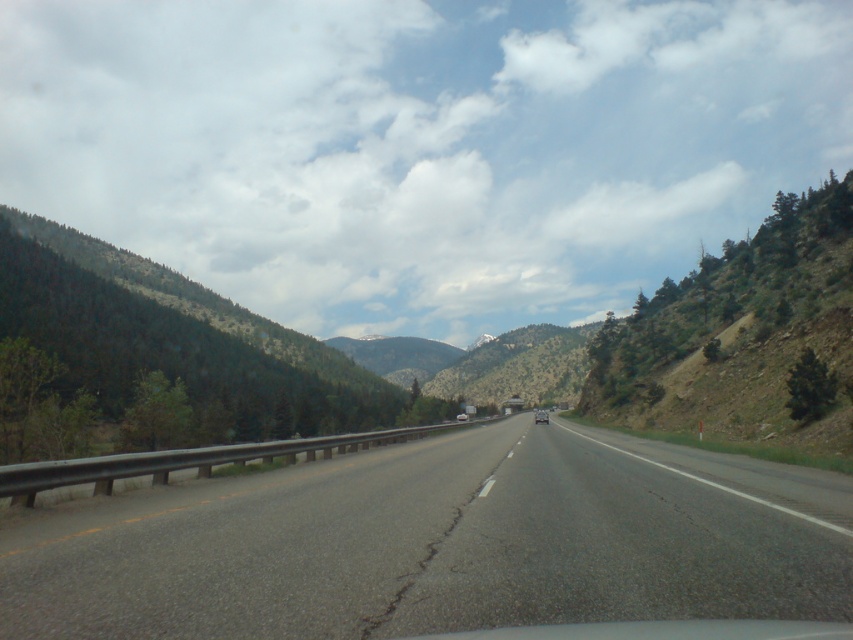
Question: Does metallic silver car at center appear under white glossy car at center?

Choices:
 (A) yes
 (B) no

Answer: (A)

Question: Which point is farther to the camera?

Choices:
 (A) (112, 634)
 (B) (535, 419)

Answer: (B)

Question: From the image, what is the correct spatial relationship of asphalt road at center in relation to white glossy car at center?

Choices:
 (A) below
 (B) above

Answer: (B)

Question: Which of the following is the closest to the observer?

Choices:
 (A) (541, 413)
 (B) (463, 412)
 (C) (728, 566)

Answer: (C)

Question: Which point is farther to the camera?

Choices:
 (A) (175, 552)
 (B) (460, 413)
 (C) (538, 413)

Answer: (B)

Question: Is metallic silver car at center smaller than white glossy car at center?

Choices:
 (A) no
 (B) yes

Answer: (A)